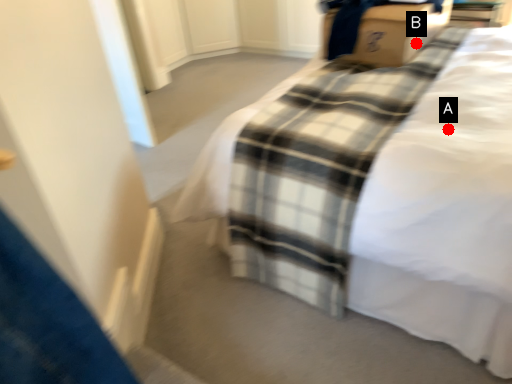
Question: Two points are circled on the image, labeled by A and B beside each circle. Which of the following is the closest to the observer?

Choices:
 (A) A is closer
 (B) B is closer

Answer: (A)